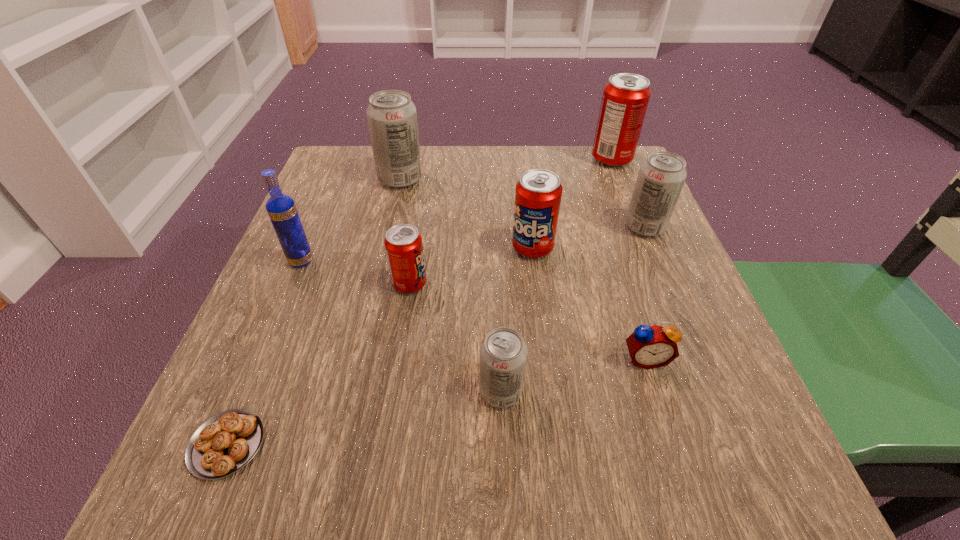
Point out which red soda can is positioned as the nearest to the leftmost gray soda can. Please provide its 2D coordinates. Your answer should be formatted as a tuple, i.e. [(x, y)], where the tuple contains the x and y coordinates of a point satisfying the conditions above.

[(538, 194)]

Identify which gray soda can is located as the second nearest to the vodka. Please provide its 2D coordinates. Your answer should be formatted as a tuple, i.e. [(x, y)], where the tuple contains the x and y coordinates of a point satisfying the conditions above.

[(503, 353)]

The width and height of the screenshot is (960, 540). In order to click on gray soda can that can be found as the closest to the second biggest gray soda can in this screenshot , I will do `click(503, 353)`.